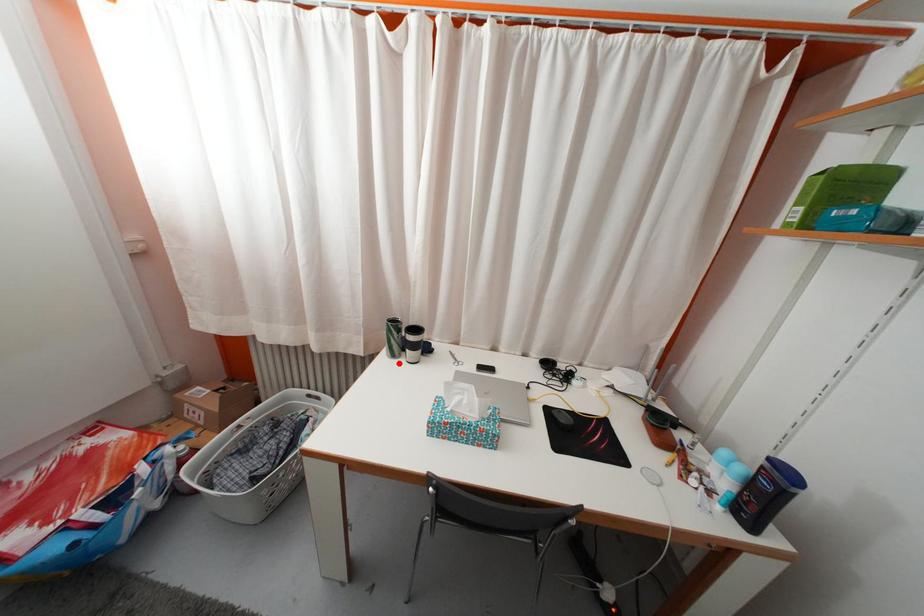
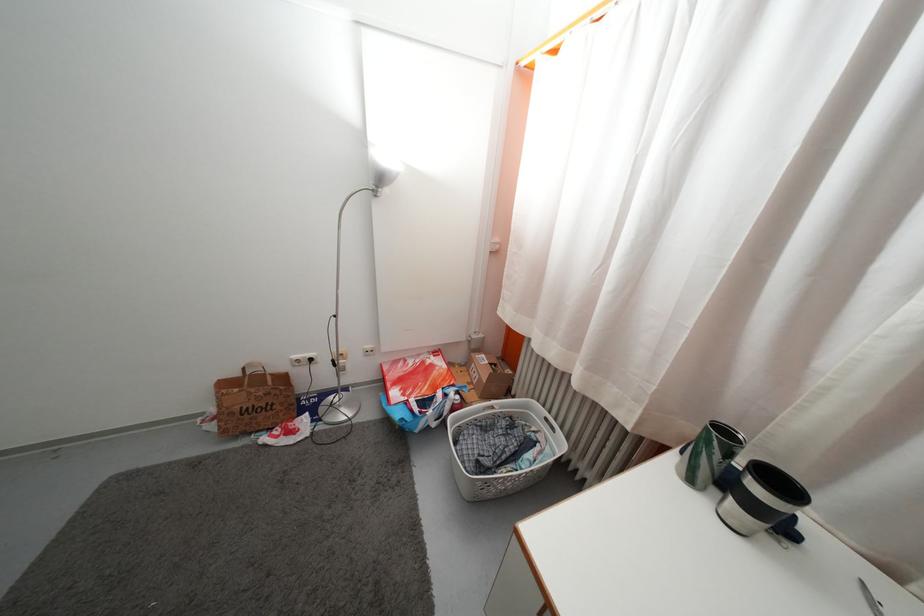
Find the pixel in the second image that matches the highlighted location in the first image.

(697, 488)